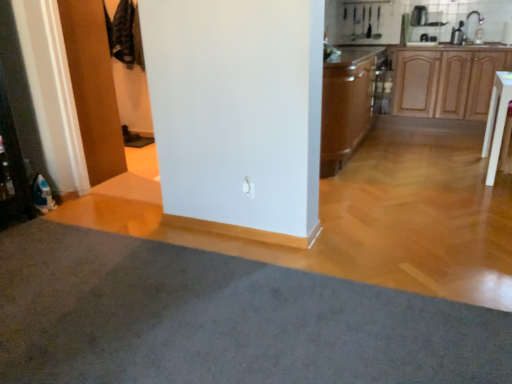
Question: Considering the relative sizes of wooden cabinet at right, which is the second cabinetry in left-to-right order, and wooden at upper right in the image provided, is wooden cabinet at right, which is the second cabinetry in left-to-right order, smaller than wooden at upper right?

Choices:
 (A) yes
 (B) no

Answer: (B)

Question: Does wooden cabinet at right, which is the second cabinetry in left-to-right order, have a greater width compared to wooden at upper right?

Choices:
 (A) no
 (B) yes

Answer: (B)

Question: From the image's perspective, would you say wooden cabinet at right, which is the second cabinetry in left-to-right order, is positioned over wooden at upper right?

Choices:
 (A) no
 (B) yes

Answer: (A)

Question: Is there a large distance between wooden cabinet at right, the 1th cabinetry in the right-to-left sequence, and wooden at upper right?

Choices:
 (A) yes
 (B) no

Answer: (A)

Question: Can you confirm if wooden cabinet at right, which is the second cabinetry in left-to-right order, is shorter than wooden at upper right?

Choices:
 (A) no
 (B) yes

Answer: (A)

Question: From a real-world perspective, is wooden at upper right physically located above or below gray carpet at lower left?

Choices:
 (A) below
 (B) above

Answer: (B)

Question: Is wooden at upper right inside the boundaries of gray carpet at lower left, or outside?

Choices:
 (A) inside
 (B) outside

Answer: (B)

Question: Is wooden at upper right bigger or smaller than gray carpet at lower left?

Choices:
 (A) big
 (B) small

Answer: (B)

Question: In terms of height, does wooden at upper right look taller or shorter compared to gray carpet at lower left?

Choices:
 (A) tall
 (B) short

Answer: (A)

Question: From the image's perspective, relative to wooden cabinet at right, which is the second cabinetry in left-to-right order, is wooden door at left above or below?

Choices:
 (A) below
 (B) above

Answer: (A)

Question: Is wooden door at left inside or outside of wooden cabinet at right, the 1th cabinetry in the right-to-left sequence?

Choices:
 (A) outside
 (B) inside

Answer: (A)

Question: In terms of size, does wooden door at left appear bigger or smaller than wooden cabinet at right, the 1th cabinetry in the right-to-left sequence?

Choices:
 (A) small
 (B) big

Answer: (A)

Question: Is point (97, 104) closer or farther from the camera than point (418, 49)?

Choices:
 (A) farther
 (B) closer

Answer: (B)

Question: In terms of height, does wooden door at left look taller or shorter compared to brown wood cabinet at center, positioned as the 2th cabinetry in right-to-left order?

Choices:
 (A) tall
 (B) short

Answer: (A)

Question: Considering the positions of wooden door at left and brown wood cabinet at center, positioned as the 2th cabinetry in right-to-left order, in the image, is wooden door at left bigger or smaller than brown wood cabinet at center, positioned as the 2th cabinetry in right-to-left order,?

Choices:
 (A) big
 (B) small

Answer: (B)